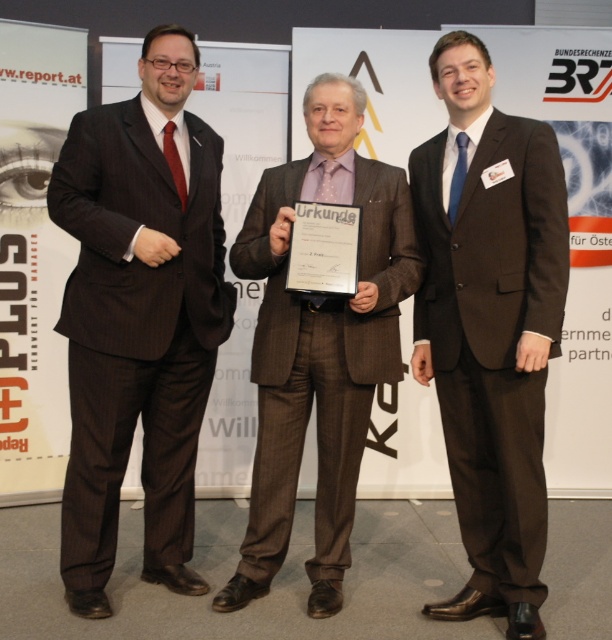
Between matte black suit at left and matte brown suit at center, which one appears on the left side from the viewer's perspective?

matte black suit at left is more to the left.

Which of these two, matte black suit at left or matte brown suit at center, stands taller?

Standing taller between the two is matte black suit at left.

Between point (170, 244) and point (501, 483), which one is positioned in front?

Point (501, 483) is more forward.

Find the location of `matte black suit at left`. matte black suit at left is located at coordinates (140, 316).

Does matte black suit at left appear under brown textured suit at center?

No, matte black suit at left is not below brown textured suit at center.

Who is more distant from viewer, (181, 298) or (368, 256)?

The point (368, 256) is more distant.

Is point (177, 545) in front of point (252, 221)?

That is False.

Locate an element on the screen. The image size is (612, 640). matte black suit at left is located at coordinates (140, 316).

Describe the element at coordinates (490, 324) in the screenshot. I see `matte brown suit at center` at that location.

Is point (496, 541) behind point (345, 301)?

Yes, point (496, 541) is behind point (345, 301).

Who is more distant from viewer, [449,237] or [302,340]?

Point [302,340]

Where is `matte brown suit at center`? matte brown suit at center is located at coordinates (490, 324).